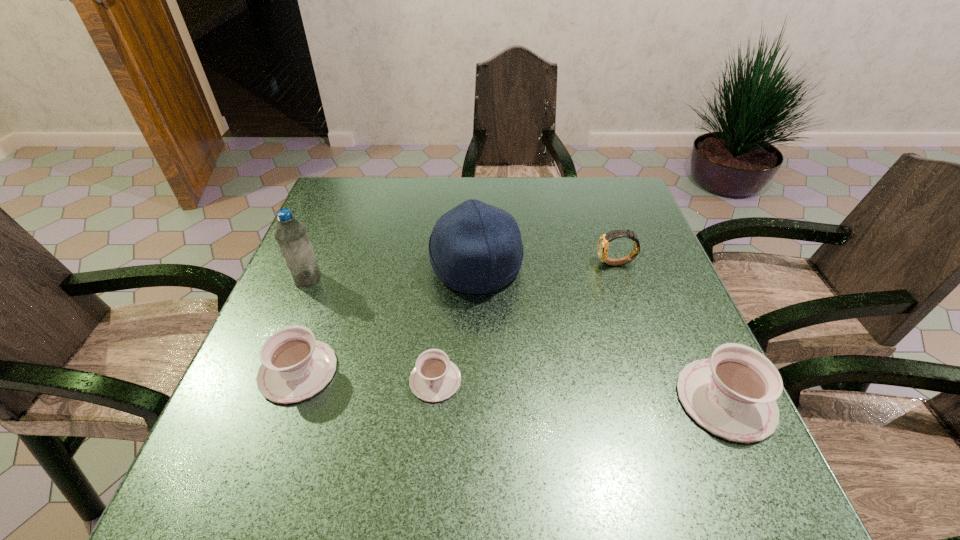
The image size is (960, 540). In order to click on vacant spot for a new teacup to ensure equal spacing in this screenshot , I will do `click(578, 390)`.